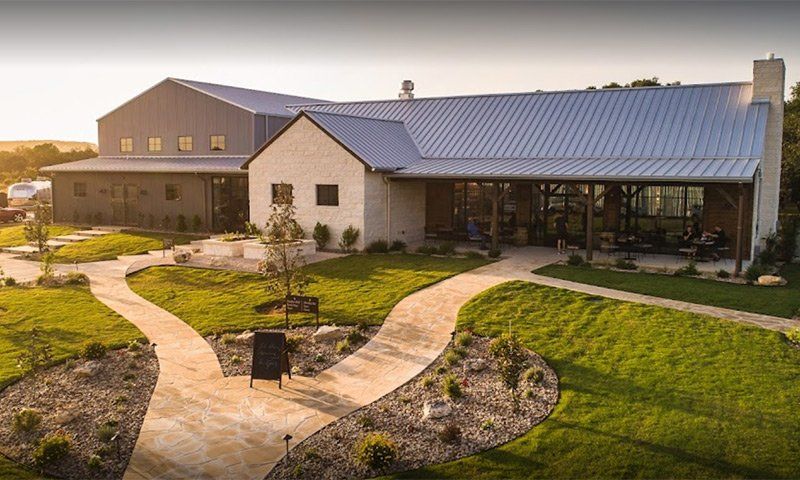
Where is `small square window`? small square window is located at coordinates (220, 144), (185, 145), (154, 145), (125, 146), (80, 189), (177, 194), (277, 198), (328, 196).